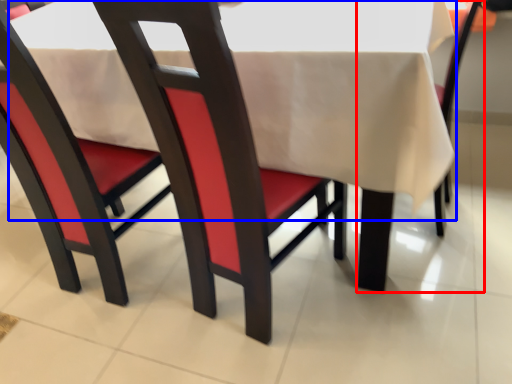
Question: Which object is closer to the camera taking this photo, chair (highlighted by a red box) or tablecloth (highlighted by a blue box)?

Choices:
 (A) chair
 (B) tablecloth

Answer: (B)